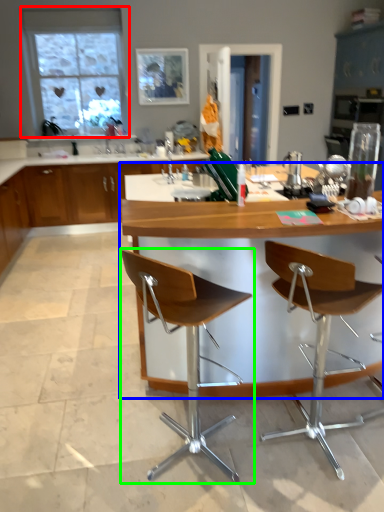
Question: Based on their relative distances, which object is nearer to window (highlighted by a red box)? Choose from table (highlighted by a blue box) and chair (highlighted by a green box).

Choices:
 (A) table
 (B) chair

Answer: (A)